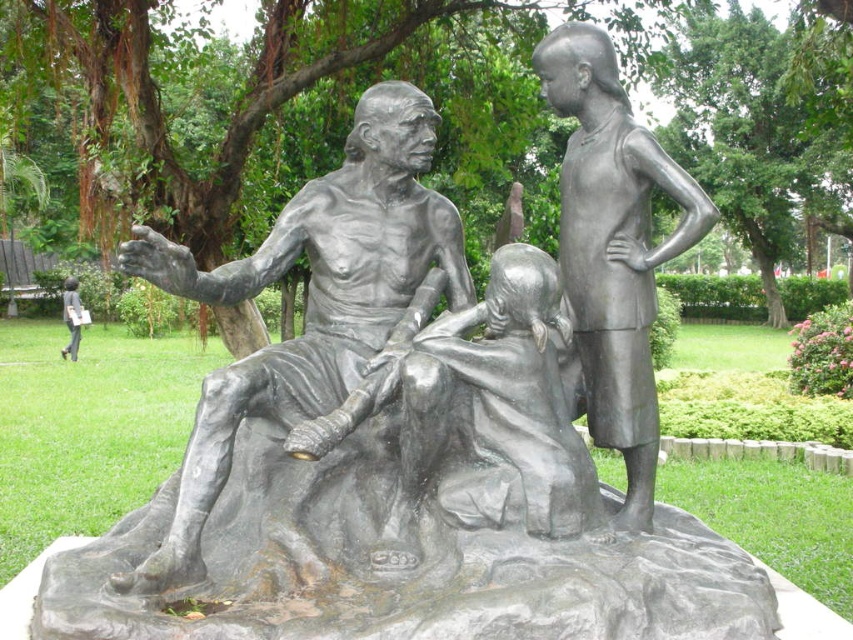
From the picture: You are an art student observing the bronze statue of man at center and the bronze statue of child at center in the park. Based on their sizes, which statue would cast a longer shadow during midday when the sun is directly overhead?

The bronze statue of man at center is larger than the bronze statue of child at center, so it would cast a longer shadow during midday when the sun is directly overhead.

You are standing at the point labeled as point (637, 266) in the park. You want to take a photo of the bronze sculpture. Is the sculpture visible from your current position?

The point labeled point (637, 266) is 3.53 meters away from the viewer. Since the sculpture is situated in an open park setting, there are no obstructions mentioned in the scene description, so the sculpture should be visible from that position.